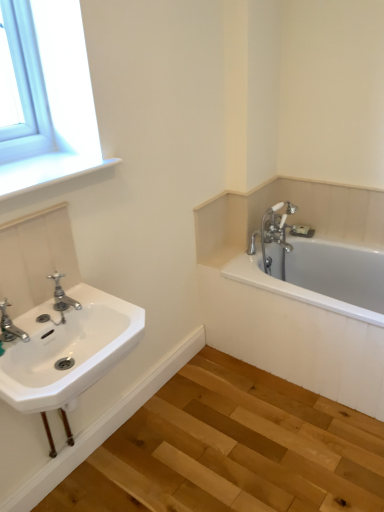
Find the location of a particular element. The width and height of the screenshot is (384, 512). white ceramic bathtub at right is located at coordinates (316, 318).

The height and width of the screenshot is (512, 384). Identify the location of polished chrome faucet at left, the first tap from the right. (62, 295).

Is white porcelain sink at left at the back of brushed metal faucet at lower left, acting as the 2th tap starting from the back?

No.

Would you say brushed metal faucet at lower left, which appears as the 2th tap when viewed from the right, is inside or outside white porcelain sink at left?

brushed metal faucet at lower left, which appears as the 2th tap when viewed from the right, lies outside white porcelain sink at left.

Who is more distant, brushed metal faucet at lower left, the 1th tap viewed from the front, or white porcelain sink at left?

brushed metal faucet at lower left, the 1th tap viewed from the front, is further away from the camera.

What are the coordinates of `sink on the right side of brushed metal faucet at lower left, the first tap in the left-to-right sequence` in the screenshot? It's located at click(67, 349).

Starting from the white porcelain sink at left, which tap is the 1st one to the left? Please provide its 2D coordinates.

[(62, 295)]

Can you confirm if white porcelain sink at left is positioned to the left of polished chrome faucet at left, which is the first tap in back-to-front order?

Incorrect, white porcelain sink at left is not on the left side of polished chrome faucet at left, which is the first tap in back-to-front order.

Can you tell me how much white porcelain sink at left and polished chrome faucet at left, the first tap from the right, differ in facing direction?

0.00231 degrees.

Considering the positions of objects white smooth window sill at upper left and white porcelain sink at left in the image provided, who is more to the left, white smooth window sill at upper left or white porcelain sink at left?

Positioned to the left is white smooth window sill at upper left.

Locate an element on the screen. window sill on the left of the white porcelain sink at left is located at coordinates (46, 170).

Would you say white smooth window sill at upper left is a long distance from white porcelain sink at left?

No, there isn't a large distance between white smooth window sill at upper left and white porcelain sink at left.

In terms of width, does white smooth window sill at upper left look wider or thinner when compared to white porcelain sink at left?

Clearly, white smooth window sill at upper left has more width compared to white porcelain sink at left.

From a real-world perspective, is brushed metal faucet at lower left, acting as the 2th tap starting from the back, above or below polished chrome faucet at left, the first tap from the right?

In terms of real-world spatial position, brushed metal faucet at lower left, acting as the 2th tap starting from the back, is above polished chrome faucet at left, the first tap from the right.

Based on their sizes in the image, would you say brushed metal faucet at lower left, the 1th tap viewed from the front, is bigger or smaller than polished chrome faucet at left, the first tap from the right?

Clearly, brushed metal faucet at lower left, the 1th tap viewed from the front, is larger in size than polished chrome faucet at left, the first tap from the right.

Is brushed metal faucet at lower left, the first tap in the left-to-right sequence, positioned behind polished chrome faucet at left, the 2th tap viewed from the front?

No.

Is brushed metal faucet at lower left, acting as the 2th tap starting from the back, taller or shorter than polished chrome faucet at left, the 2th tap viewed from the front?

Clearly, brushed metal faucet at lower left, acting as the 2th tap starting from the back, is shorter compared to polished chrome faucet at left, the 2th tap viewed from the front.

Does polished chrome faucet at left, the 2th tap viewed from the front, contain white smooth window sill at upper left?

Actually, white smooth window sill at upper left is outside polished chrome faucet at left, the 2th tap viewed from the front.

Considering the sizes of objects polished chrome faucet at left, which is the first tap in back-to-front order, and white smooth window sill at upper left in the image provided, who is bigger, polished chrome faucet at left, which is the first tap in back-to-front order, or white smooth window sill at upper left?

With larger size is white smooth window sill at upper left.

Is polished chrome faucet at left, arranged as the second tap when viewed from the left, aimed at white smooth window sill at upper left?

No.

Can you confirm if polished chrome faucet at left, the first tap from the right, is taller than white smooth window sill at upper left?

Yes.

Considering the relative sizes of brushed metal faucet at lower left, which appears as the 2th tap when viewed from the right, and white smooth window sill at upper left in the image provided, is brushed metal faucet at lower left, which appears as the 2th tap when viewed from the right, bigger than white smooth window sill at upper left?

No.

Which object is closer to the camera, brushed metal faucet at lower left, the 1th tap viewed from the front, or white smooth window sill at upper left?

Positioned in front is brushed metal faucet at lower left, the 1th tap viewed from the front.

Can you confirm if brushed metal faucet at lower left, the 1th tap viewed from the front, is positioned to the left of white smooth window sill at upper left?

Incorrect, brushed metal faucet at lower left, the 1th tap viewed from the front, is not on the left side of white smooth window sill at upper left.

This screenshot has width=384, height=512. I want to click on tap in front of the white smooth window sill at upper left, so click(x=10, y=326).

Is white smooth window sill at upper left completely or partially outside of brushed metal faucet at lower left, the first tap in the left-to-right sequence?

Indeed, white smooth window sill at upper left is completely outside brushed metal faucet at lower left, the first tap in the left-to-right sequence.

Which of these two, white smooth window sill at upper left or brushed metal faucet at lower left, which appears as the 2th tap when viewed from the right, is thinner?

brushed metal faucet at lower left, which appears as the 2th tap when viewed from the right.

From a real-world perspective, is white smooth window sill at upper left physically located above or below brushed metal faucet at lower left, which appears as the 2th tap when viewed from the right?

white smooth window sill at upper left is above brushed metal faucet at lower left, which appears as the 2th tap when viewed from the right.

Which object is closer to the camera taking this photo, white smooth window sill at upper left or brushed metal faucet at lower left, which appears as the 2th tap when viewed from the right?

Positioned in front is brushed metal faucet at lower left, which appears as the 2th tap when viewed from the right.

This screenshot has height=512, width=384. There is a white porcelain sink at left. In order to click on the 2nd tap above it (from a real-world perspective) in this screenshot , I will do `click(10, 326)`.

Identify the location of sink on the right of the polished chrome faucet at left, the 2th tap viewed from the front. (67, 349).

From the image, which object appears to be nearer to white porcelain sink at left, white ceramic bathtub at right or brushed metal faucet at lower left, the first tap in the left-to-right sequence?

brushed metal faucet at lower left, the first tap in the left-to-right sequence, is closer to white porcelain sink at left.

From the image, which object appears to be farther from white ceramic bathtub at right, white smooth window sill at upper left or polished chrome faucet at left, the first tap from the right?

The object further to white ceramic bathtub at right is polished chrome faucet at left, the first tap from the right.

From the image, which object appears to be nearer to brushed metal faucet at lower left, the 1th tap viewed from the front, white ceramic bathtub at right or white smooth window sill at upper left?

The object closer to brushed metal faucet at lower left, the 1th tap viewed from the front, is white smooth window sill at upper left.

Considering their positions, is white ceramic bathtub at right positioned closer to polished chrome faucet at left, which is the first tap in back-to-front order, than white porcelain sink at left?

white porcelain sink at left is closer to polished chrome faucet at left, which is the first tap in back-to-front order.

Looking at the image, which one is located further to polished chrome faucet at left, the first tap from the right, white porcelain sink at left or white smooth window sill at upper left?

white smooth window sill at upper left is further to polished chrome faucet at left, the first tap from the right.

When comparing their distances from white ceramic bathtub at right, does polished chrome faucet at left, the 2th tap viewed from the front, or white porcelain sink at left seem further?

Based on the image, polished chrome faucet at left, the 2th tap viewed from the front, appears to be further to white ceramic bathtub at right.

Based on their spatial positions, is polished chrome faucet at left, the 2th tap viewed from the front, or brushed metal faucet at lower left, the first tap in the left-to-right sequence, further from white porcelain sink at left?

polished chrome faucet at left, the 2th tap viewed from the front.

Considering their positions, is white ceramic bathtub at right positioned closer to polished chrome faucet at left, the 2th tap viewed from the front, than brushed metal faucet at lower left, acting as the 2th tap starting from the back?

brushed metal faucet at lower left, acting as the 2th tap starting from the back, is positioned closer to the anchor polished chrome faucet at left, the 2th tap viewed from the front.

Locate an element on the screen. The image size is (384, 512). tap between white porcelain sink at left and polished chrome faucet at left, arranged as the second tap when viewed from the left, along the z-axis is located at coordinates (10, 326).

Locate an element on the screen. This screenshot has height=512, width=384. sink between polished chrome faucet at left, arranged as the second tap when viewed from the left, and white ceramic bathtub at right from left to right is located at coordinates (67, 349).

Where is `tap that lies between white smooth window sill at upper left and brushed metal faucet at lower left, the first tap in the left-to-right sequence, from top to bottom`? The image size is (384, 512). tap that lies between white smooth window sill at upper left and brushed metal faucet at lower left, the first tap in the left-to-right sequence, from top to bottom is located at coordinates (62, 295).

At what (x,y) coordinates should I click in order to perform the action: click on sink located between brushed metal faucet at lower left, the 1th tap viewed from the front, and white ceramic bathtub at right in the left-right direction. Please return your answer as a coordinate pair (x, y). The width and height of the screenshot is (384, 512). Looking at the image, I should click on (67, 349).